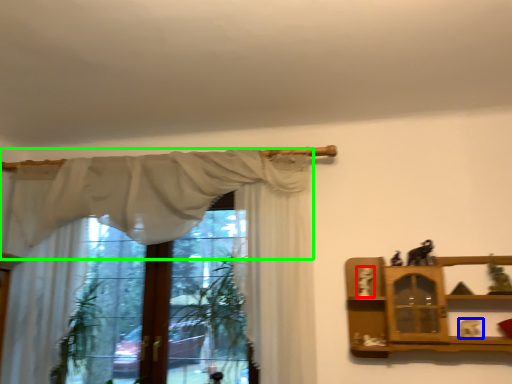
Question: Considering the real-world distances, which object is closest to toy (highlighted by a red box)? toy (highlighted by a blue box) or curtain (highlighted by a green box).

Choices:
 (A) toy
 (B) curtain

Answer: (A)